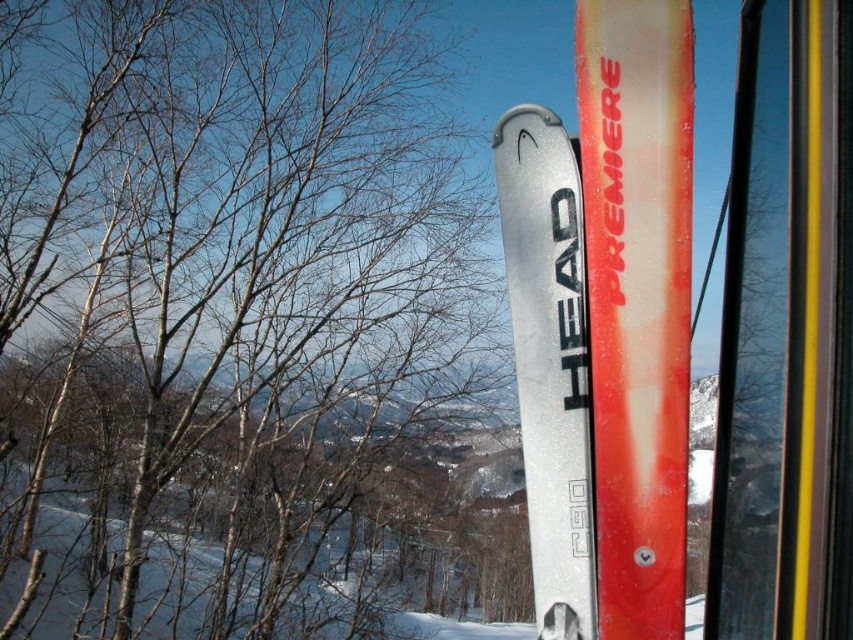
Question: Is bare branches at upper left positioned at the back of satin silver ski at center?

Choices:
 (A) no
 (B) yes

Answer: (B)

Question: Which point appears closest to the camera in this image?

Choices:
 (A) (498, 195)
 (B) (117, 3)

Answer: (A)

Question: Considering the relative positions of bare branches at upper left and satin silver ski at center in the image provided, where is bare branches at upper left located with respect to satin silver ski at center?

Choices:
 (A) below
 (B) above

Answer: (A)

Question: Which point is closer to the camera?

Choices:
 (A) bare branches at upper left
 (B) satin silver ski at center

Answer: (B)

Question: Among these points, which one is farthest from the camera?

Choices:
 (A) (548, 515)
 (B) (102, 276)

Answer: (B)

Question: Does bare branches at upper left have a larger size compared to satin silver ski at center?

Choices:
 (A) yes
 (B) no

Answer: (B)